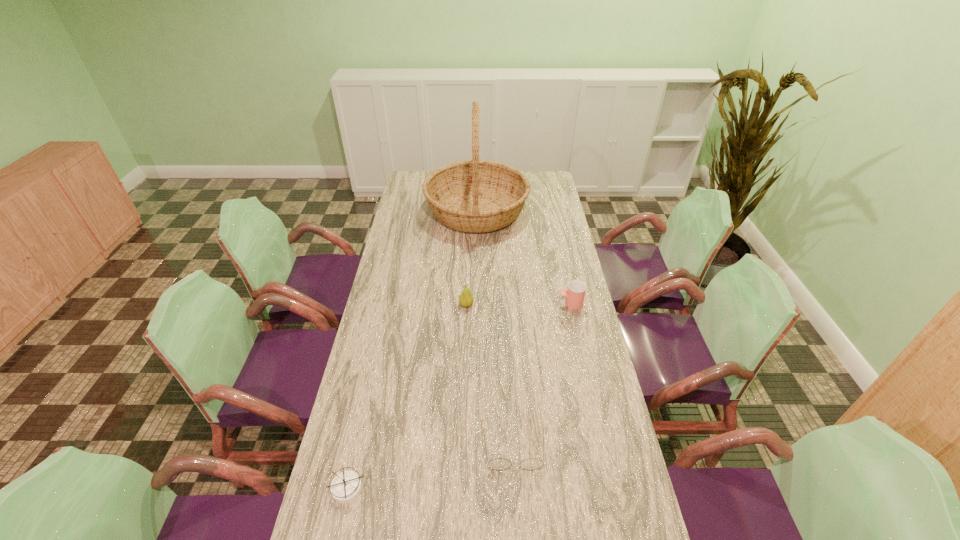
You are a GUI agent. You are given a task and a screenshot of the screen. Output one action in this format:
    pyautogui.click(x=<x>, y=<y>)
    Task: Click on the free space between the basket and the second tallest object
    Image resolution: width=960 pixels, height=540 pixels.
    Given the screenshot: What is the action you would take?
    pyautogui.click(x=471, y=258)

Find the location of a particular element. The width and height of the screenshot is (960, 540). free point between the tallest object and the leftmost object is located at coordinates (412, 349).

Locate an element on the screen. Image resolution: width=960 pixels, height=540 pixels. free space between the shortest object and the second tallest object is located at coordinates (407, 396).

Image resolution: width=960 pixels, height=540 pixels. I want to click on vacant area that lies between the spectacles and the pear, so click(x=490, y=375).

Where is `object that is the nearest to the spectacles`? The width and height of the screenshot is (960, 540). object that is the nearest to the spectacles is located at coordinates (346, 486).

Locate an element on the screen. This screenshot has width=960, height=540. object that is the nearest to the farthest object is located at coordinates (575, 294).